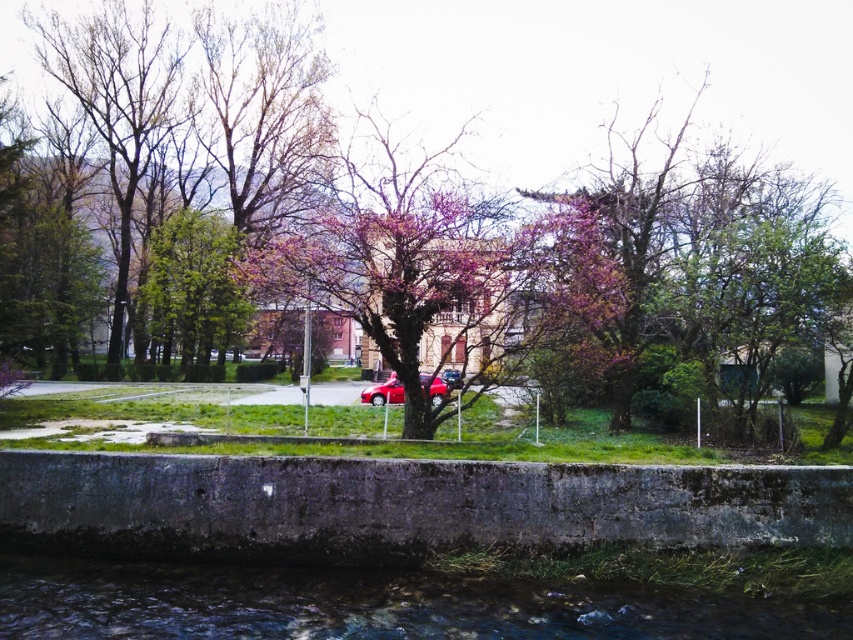
You are standing on the concrete embankment and want to place a small statue exactly halfway between the clear water at lower center and the purple bloom at center. Which object will the statue be closer to?

The statue will be closer to the purple bloom at center because the clear water at lower center is shorter than the purple bloom at center, meaning the purple bloom is closer to the embankment where you are standing.